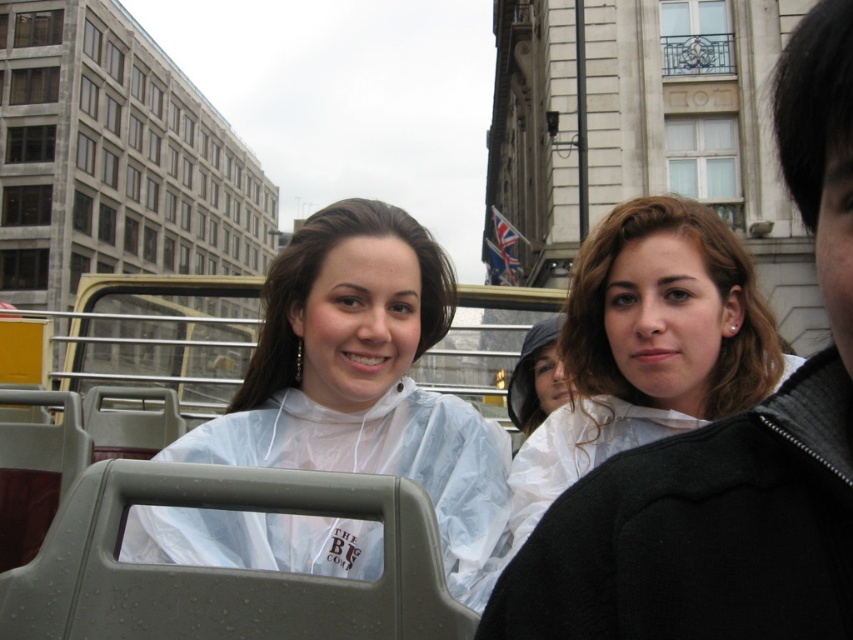
Who is more distant from viewer, (x=634, y=632) or (x=402, y=227)?

The point (x=402, y=227) is more distant.

Between transparent plastic raincoat at center and transparent plastic poncho at center, which one appears on the left side from the viewer's perspective?

Positioned to the left is transparent plastic poncho at center.

Who is more forward, (790, 600) or (497, 556)?

Point (790, 600) is in front.

This screenshot has width=853, height=640. In order to click on transparent plastic raincoat at center in this screenshot , I will do `click(727, 451)`.

Does transparent plastic poncho at center have a larger size compared to translucent white raincoat at center?

Correct, transparent plastic poncho at center is larger in size than translucent white raincoat at center.

Is point (340, 282) more distant than point (550, 497)?

That is True.

At what (x,y) coordinates should I click in order to perform the action: click on transparent plastic poncho at center. Please return your answer as a coordinate pair (x, y). Looking at the image, I should click on (364, 380).

Between transparent plastic raincoat at center and translucent white raincoat at center, which one is positioned lower?

translucent white raincoat at center

Does transparent plastic raincoat at center lie behind translucent white raincoat at center?

No, it is not.

Between point (781, 496) and point (715, 321), which one is positioned behind?

Positioned behind is point (715, 321).

Find the location of a particular element. Image resolution: width=853 pixels, height=640 pixels. transparent plastic raincoat at center is located at coordinates (727, 451).